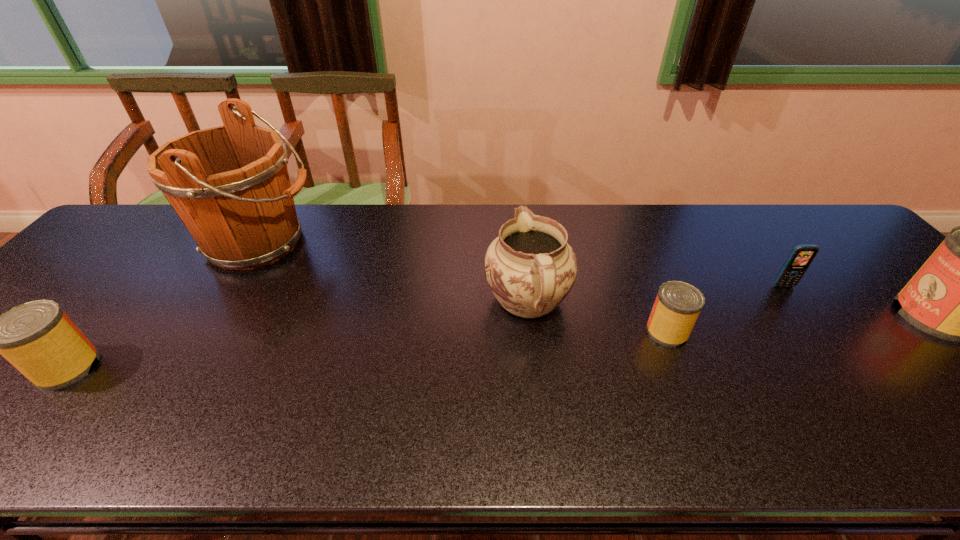
In order to click on vacant area that lies between the tallest object and the second shortest can in this screenshot , I will do coord(164,305).

The height and width of the screenshot is (540, 960). I want to click on object that is the third closest to the leftmost can, so click(678, 304).

Choose which object is the nearest neighbor to the second object from left to right. Please provide its 2D coordinates. Your answer should be formatted as a tuple, i.e. [(x, y)], where the tuple contains the x and y coordinates of a point satisfying the conditions above.

[(37, 337)]

Locate which can ranks in proximity to the second can from left to right. Please provide its 2D coordinates. Your answer should be formatted as a tuple, i.e. [(x, y)], where the tuple contains the x and y coordinates of a point satisfying the conditions above.

[(959, 294)]

Choose which can is the nearest neighbor to the rightmost can. Please provide its 2D coordinates. Your answer should be formatted as a tuple, i.e. [(x, y)], where the tuple contains the x and y coordinates of a point satisfying the conditions above.

[(678, 304)]

Where is `free point that satisfies the following two spatial constraints: 1. with the handle on the side of the fifth object from right to left; 2. on the spout of the pitcher`? The image size is (960, 540). free point that satisfies the following two spatial constraints: 1. with the handle on the side of the fifth object from right to left; 2. on the spout of the pitcher is located at coordinates (224, 302).

Where is `vacant region that satisfies the following two spatial constraints: 1. with the handle on the side of the shortest can; 2. on the right side of the fifth object from right to left`? Image resolution: width=960 pixels, height=540 pixels. vacant region that satisfies the following two spatial constraints: 1. with the handle on the side of the shortest can; 2. on the right side of the fifth object from right to left is located at coordinates (206, 332).

Find the location of `free space that satisfies the following two spatial constraints: 1. with the handle on the side of the second object from left to right; 2. on the spout of the pitcher`. free space that satisfies the following two spatial constraints: 1. with the handle on the side of the second object from left to right; 2. on the spout of the pitcher is located at coordinates pyautogui.click(x=224, y=302).